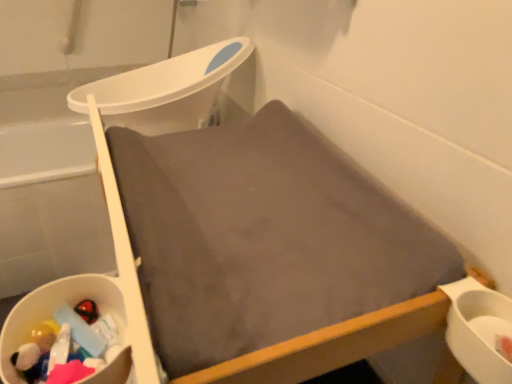
Measure the distance between white plastic potty at lower left and camera.

A distance of 18.98 inches exists between white plastic potty at lower left and camera.

The height and width of the screenshot is (384, 512). In order to click on white plastic potty at lower left in this screenshot , I will do `click(52, 317)`.

Describe the element at coordinates (52, 317) in the screenshot. I see `white plastic potty at lower left` at that location.

This screenshot has width=512, height=384. Find the location of `white plastic potty at lower left`. white plastic potty at lower left is located at coordinates (52, 317).